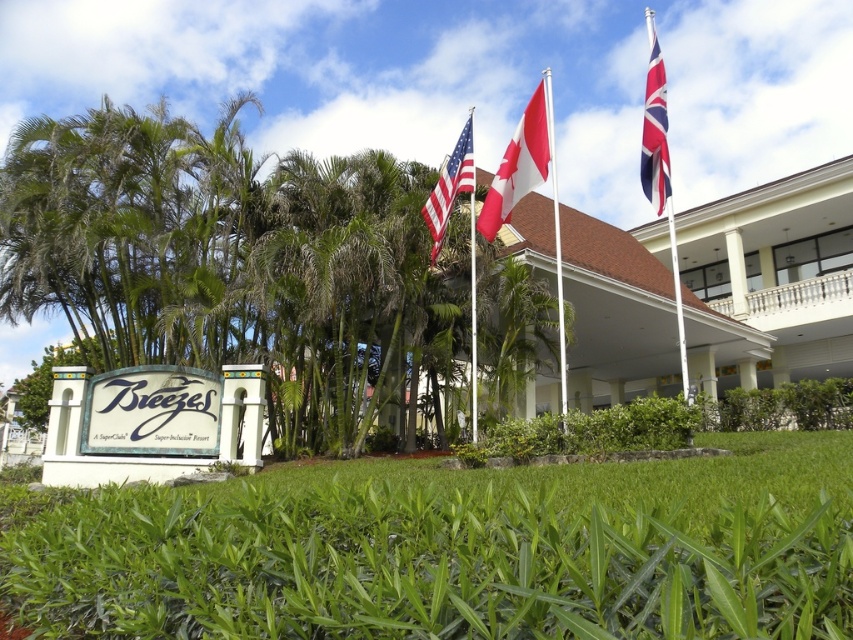
Question: Based on their relative distances, which object is farther from the polished metal flag pole at upper right?

Choices:
 (A) american flag at upper center
 (B) red/white fabric flag at center

Answer: (B)

Question: Can you confirm if red/white fabric flag at center is positioned above red fabric flagpole at center?

Choices:
 (A) yes
 (B) no

Answer: (B)

Question: Does red and white striped flag at upper right appear on the right side of red fabric flagpole at center?

Choices:
 (A) yes
 (B) no

Answer: (A)

Question: Does green leafy grass at lower center have a lesser width compared to red and white striped flag at upper right?

Choices:
 (A) no
 (B) yes

Answer: (B)

Question: Which object is closer to the camera taking this photo?

Choices:
 (A) red/white fabric flag at center
 (B) green leafy grass at lower center

Answer: (B)

Question: Based on their relative distances, which object is farther from the red fabric flagpole at center?

Choices:
 (A) polished metal flag pole at upper right
 (B) american flag at upper center
 (C) red and white striped flag at upper right

Answer: (B)